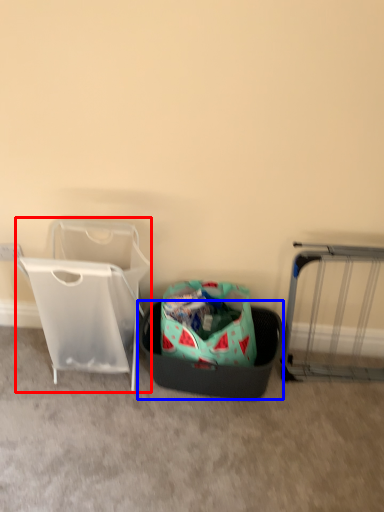
Question: Which of the following is the farthest to the observer, baby carriage (highlighted by a red box) or laundry basket (highlighted by a blue box)?

Choices:
 (A) baby carriage
 (B) laundry basket

Answer: (B)